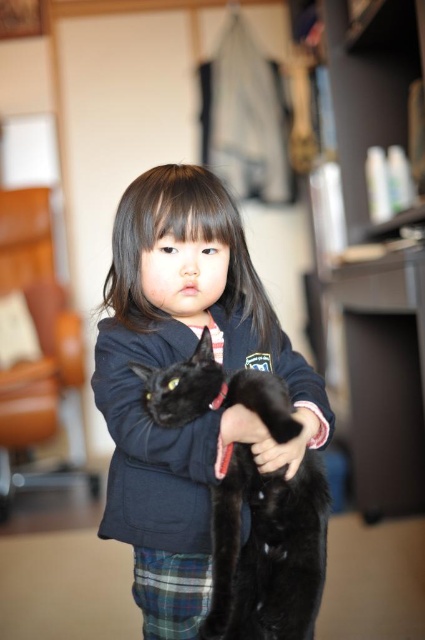
Which of these two, shiny black cat at center or plaid fabric kilt at lower center, stands shorter?

Standing shorter between the two is plaid fabric kilt at lower center.

Between shiny black cat at center and plaid fabric kilt at lower center, which one has more height?

shiny black cat at center

This screenshot has height=640, width=425. What are the coordinates of `shiny black cat at center` in the screenshot? It's located at (268, 552).